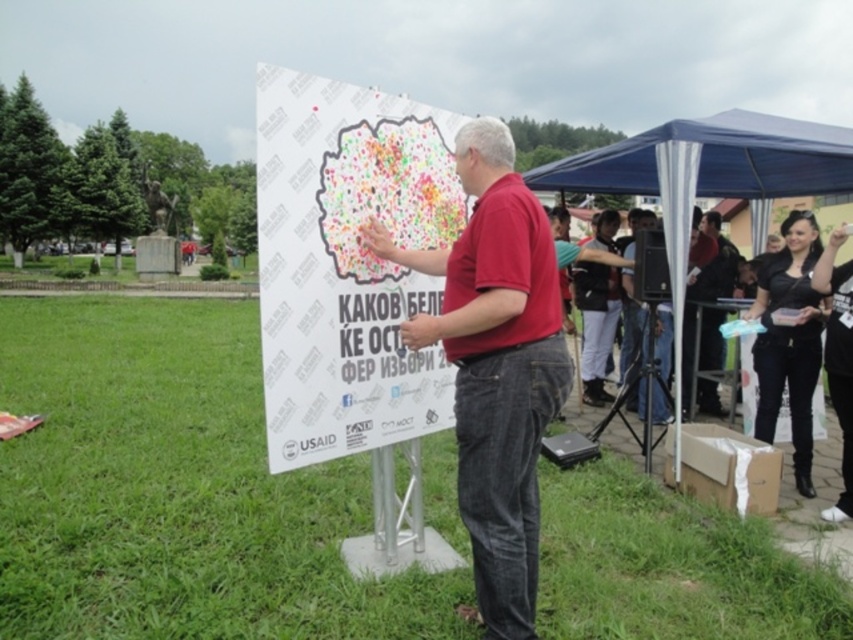
Consider the image. You are a photographer at the event and want to capture the matte red shirt at center and the black leather jacket at lower right in the same frame. Can you see both items in the photo without moving the camera?

The matte red shirt at center is positioned over the black leather jacket at lower right, so yes, both items can be seen in the same frame without moving the camera.

You are standing at the event and want to take a photo of the point at coordinates point (259, 125). If your camera can focus up to 10 feet away, will it be able to focus on that point?

The distance of point (259, 125) from viewer is 8.96 feet, which is within the camera focus range of up to 10 feet. Therefore, the camera should be able to focus on that point.